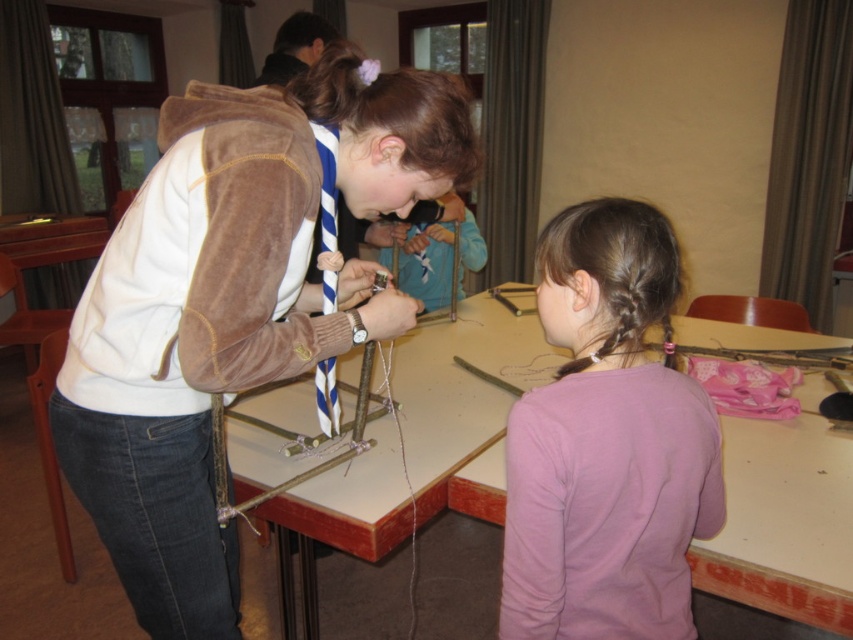
Question: Which object is positioned closest to the brown suede jacket at upper left?

Choices:
 (A) pink matte shirt at center
 (B) wooden table at center

Answer: (A)

Question: Does brown suede jacket at upper left have a lesser width compared to wooden table at center?

Choices:
 (A) yes
 (B) no

Answer: (A)

Question: Can you confirm if brown suede jacket at upper left is smaller than wooden table at center?

Choices:
 (A) no
 (B) yes

Answer: (B)

Question: Which point is farther to the camera?

Choices:
 (A) pink matte shirt at center
 (B) brown suede jacket at upper left

Answer: (B)

Question: Among these points, which one is nearest to the camera?

Choices:
 (A) (611, 545)
 (B) (461, 314)
 (C) (141, 257)

Answer: (A)

Question: Does brown suede jacket at upper left appear on the left side of pink matte shirt at center?

Choices:
 (A) yes
 (B) no

Answer: (A)